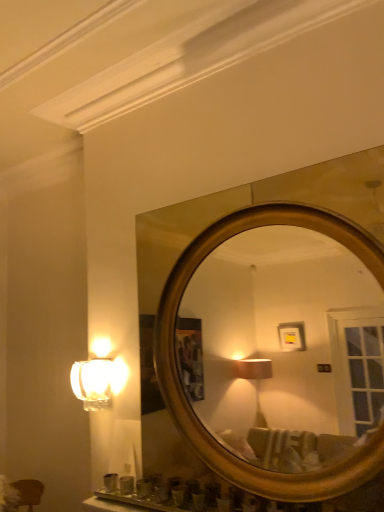
Describe the element at coordinates (254, 207) in the screenshot. I see `gold metallic mirror at upper center` at that location.

Where is `gold metallic mirror at upper center`? This screenshot has width=384, height=512. gold metallic mirror at upper center is located at coordinates (254, 207).

The image size is (384, 512). Describe the element at coordinates (92, 383) in the screenshot. I see `matte glass lamp at left` at that location.

Find the location of a particular element. The width and height of the screenshot is (384, 512). matte glass lamp at left is located at coordinates (92, 383).

Where is `gold metallic mirror at upper center`? gold metallic mirror at upper center is located at coordinates (254, 207).

From the picture: Between matte glass lamp at left and gold metallic mirror at upper center, which one appears on the right side from the viewer's perspective?

Positioned to the right is gold metallic mirror at upper center.

Is matte glass lamp at left positioned before gold metallic mirror at upper center?

No, matte glass lamp at left is behind gold metallic mirror at upper center.

Is point (82, 362) closer or farther from the camera than point (161, 238)?

Point (82, 362) is farther from the camera than point (161, 238).

From the image's perspective, is matte glass lamp at left over gold metallic mirror at upper center?

No, from the image's perspective, matte glass lamp at left is not above gold metallic mirror at upper center.

From a real-world perspective, does matte glass lamp at left sit lower than gold metallic mirror at upper center?

Yes, from a real-world perspective, matte glass lamp at left is under gold metallic mirror at upper center.

Considering the sizes of objects matte glass lamp at left and gold metallic mirror at upper center in the image provided, who is thinner, matte glass lamp at left or gold metallic mirror at upper center?

matte glass lamp at left.

In terms of height, does matte glass lamp at left look taller or shorter compared to gold metallic mirror at upper center?

Considering their sizes, matte glass lamp at left has less height than gold metallic mirror at upper center.

Considering the sizes of objects matte glass lamp at left and gold metallic mirror at upper center in the image provided, who is bigger, matte glass lamp at left or gold metallic mirror at upper center?

Bigger between the two is gold metallic mirror at upper center.

Choose the correct answer: Is matte glass lamp at left inside gold metallic mirror at upper center or outside it?

The correct answer is: outside.

Is matte glass lamp at left in contact with gold metallic mirror at upper center?

No, matte glass lamp at left is not with gold metallic mirror at upper center.

Is matte glass lamp at left turned away from gold metallic mirror at upper center?

No, matte glass lamp at left is not facing the opposite direction of gold metallic mirror at upper center.

How many degrees apart are the facing directions of matte glass lamp at left and gold metallic mirror at upper center?

The angle between the facing direction of matte glass lamp at left and the facing direction of gold metallic mirror at upper center is 0.00329 degrees.

Locate an element on the screen. This screenshot has height=512, width=384. mirror in front of the matte glass lamp at left is located at coordinates (254, 207).

Between gold metallic mirror at upper center and matte glass lamp at left, which one appears on the left side from the viewer's perspective?

From the viewer's perspective, matte glass lamp at left appears more on the left side.

Is gold metallic mirror at upper center in front of or behind matte glass lamp at left in the image?

gold metallic mirror at upper center is positioned closer to the viewer than matte glass lamp at left.

Which point is more distant from viewer, (266, 188) or (96, 362)?

The point (96, 362) is farther from the camera.

Based on the photo, from the image's perspective, is gold metallic mirror at upper center below matte glass lamp at left?

Actually, gold metallic mirror at upper center appears above matte glass lamp at left in the image.

From a real-world perspective, which object rests below the other?

From a 3D spatial view, matte glass lamp at left is below.

Which object is thinner, gold metallic mirror at upper center or matte glass lamp at left?

With smaller width is matte glass lamp at left.

Considering the sizes of objects gold metallic mirror at upper center and matte glass lamp at left in the image provided, who is shorter, gold metallic mirror at upper center or matte glass lamp at left?

matte glass lamp at left is shorter.

Can you confirm if gold metallic mirror at upper center is smaller than matte glass lamp at left?

No, gold metallic mirror at upper center is not smaller than matte glass lamp at left.

Looking at this image, would you say gold metallic mirror at upper center is outside matte glass lamp at left?

Yes, gold metallic mirror at upper center is not within matte glass lamp at left.

Is gold metallic mirror at upper center next to matte glass lamp at left?

No, gold metallic mirror at upper center is not making contact with matte glass lamp at left.

Is gold metallic mirror at upper center oriented away from matte glass lamp at left?

That's not correct — gold metallic mirror at upper center is not looking away from matte glass lamp at left.

How different are the orientations of gold metallic mirror at upper center and matte glass lamp at left in degrees?

There is a 0.00329-degree angle between the facing directions of gold metallic mirror at upper center and matte glass lamp at left.

How much distance is there between gold metallic mirror at upper center and matte glass lamp at left?

gold metallic mirror at upper center and matte glass lamp at left are 23.30 inches apart.

In the image, there is a gold metallic mirror at upper center. Find the location of `lamp below it (from the image's perspective)`. lamp below it (from the image's perspective) is located at coordinates 92,383.

Locate an element on the screen. Image resolution: width=384 pixels, height=512 pixels. lamp behind the gold metallic mirror at upper center is located at coordinates (92, 383).

Find the location of a particular element. The height and width of the screenshot is (512, 384). lamp below the gold metallic mirror at upper center (from the image's perspective) is located at coordinates (92, 383).